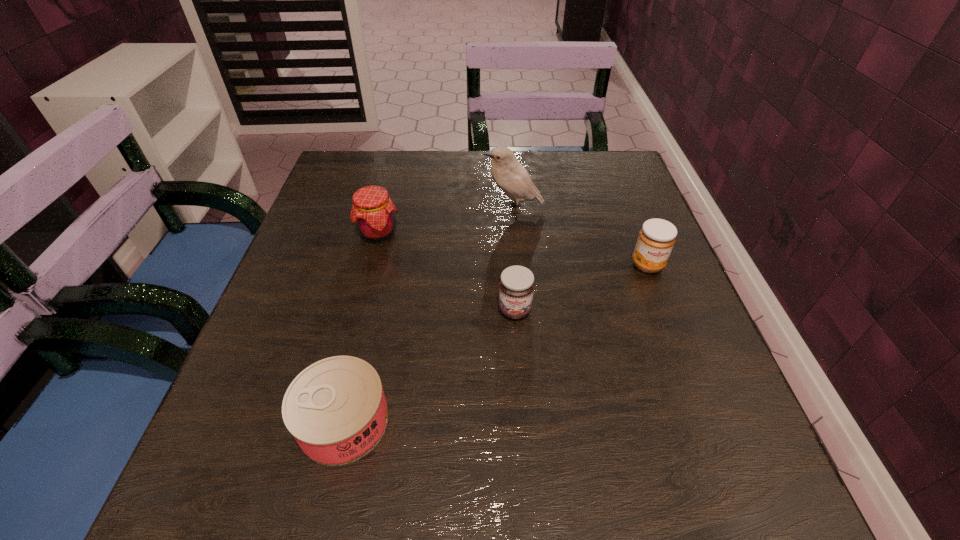
Where is `object that is positioned at the right edge`? This screenshot has width=960, height=540. object that is positioned at the right edge is located at coordinates (656, 239).

You are a GUI agent. You are given a task and a screenshot of the screen. Output one action in this format:
    pyautogui.click(x=<x>, y=<y>)
    Task: Click on the object present at the near left corner
    This screenshot has width=960, height=540.
    Given the screenshot: What is the action you would take?
    pyautogui.click(x=336, y=410)

Locate an element on the screen. free region at the far edge is located at coordinates (549, 152).

Identify the location of blank space at the near edge. (363, 519).

At what (x,y) coordinates should I click in order to perform the action: click on vacant region at the left edge of the desktop. Please return your answer as a coordinate pair (x, y). This screenshot has height=540, width=960. Looking at the image, I should click on (253, 454).

Where is `free region at the right edge of the desktop`? The width and height of the screenshot is (960, 540). free region at the right edge of the desktop is located at coordinates (606, 280).

In the image, there is a desktop. Where is `vacant area at the far left corner`? vacant area at the far left corner is located at coordinates [390, 170].

In the image, there is a desktop. Where is `vacant space at the near left corner`? The image size is (960, 540). vacant space at the near left corner is located at coordinates (198, 472).

Find the location of `blank area at the far right corner`. blank area at the far right corner is located at coordinates (588, 179).

Find the location of a particular element. Image resolution: width=960 pixels, height=540 pixels. vacant region between the can and the farthest jam is located at coordinates (361, 327).